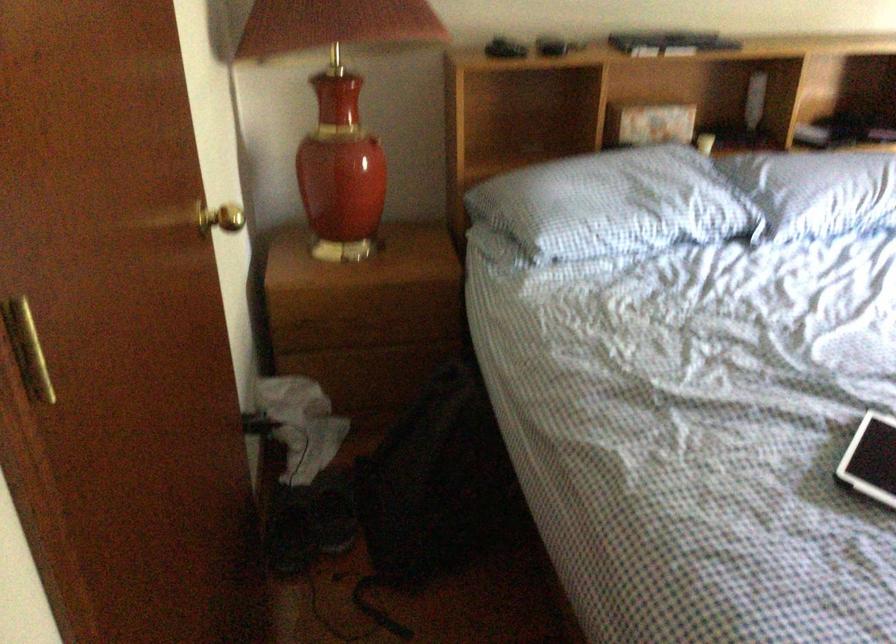
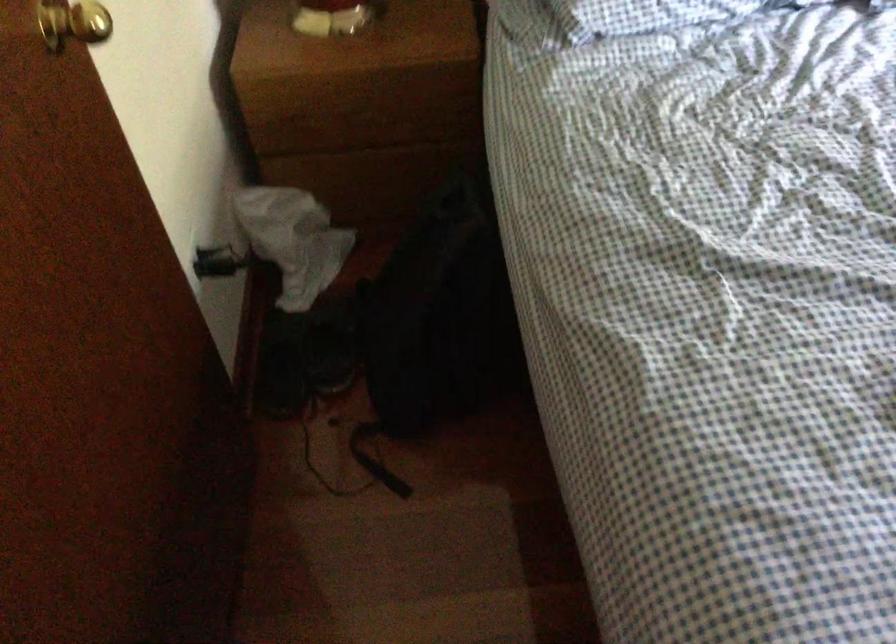
In the second image, find the point that corresponds to [438,473] in the first image.

(441, 317)